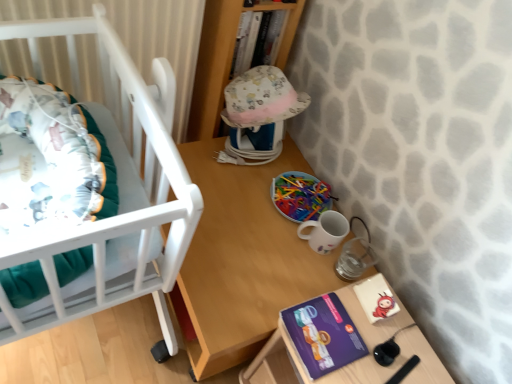
Question: Is purple cardboard box at lower right positioned far away from white glossy mug at lower right?

Choices:
 (A) no
 (B) yes

Answer: (A)

Question: Is purple cardboard box at lower right positioned with its back to white glossy mug at lower right?

Choices:
 (A) yes
 (B) no

Answer: (B)

Question: Does purple cardboard box at lower right contain white glossy mug at lower right?

Choices:
 (A) no
 (B) yes

Answer: (A)

Question: Would you say purple cardboard box at lower right is outside white glossy mug at lower right?

Choices:
 (A) no
 (B) yes

Answer: (B)

Question: Is purple cardboard box at lower right bigger than white glossy mug at lower right?

Choices:
 (A) no
 (B) yes

Answer: (B)

Question: Does purple cardboard box at lower right have a lesser height compared to white glossy mug at lower right?

Choices:
 (A) no
 (B) yes

Answer: (A)

Question: Is wooden table at center bigger than purple matte paperback book at lower right?

Choices:
 (A) no
 (B) yes

Answer: (B)

Question: From the image's perspective, would you say wooden table at center is positioned over purple matte paperback book at lower right?

Choices:
 (A) yes
 (B) no

Answer: (A)

Question: Is purple matte paperback book at lower right inside wooden table at center?

Choices:
 (A) no
 (B) yes

Answer: (A)

Question: Does wooden table at center appear on the left side of purple matte paperback book at lower right?

Choices:
 (A) yes
 (B) no

Answer: (A)

Question: Is wooden table at center shorter than purple matte paperback book at lower right?

Choices:
 (A) no
 (B) yes

Answer: (A)

Question: Considering the relative sizes of wooden table at center and purple matte paperback book at lower right in the image provided, is wooden table at center taller than purple matte paperback book at lower right?

Choices:
 (A) no
 (B) yes

Answer: (B)

Question: Can you see multicolored plastic sticks at center touching purple matte paperback book at lower right?

Choices:
 (A) no
 (B) yes

Answer: (A)